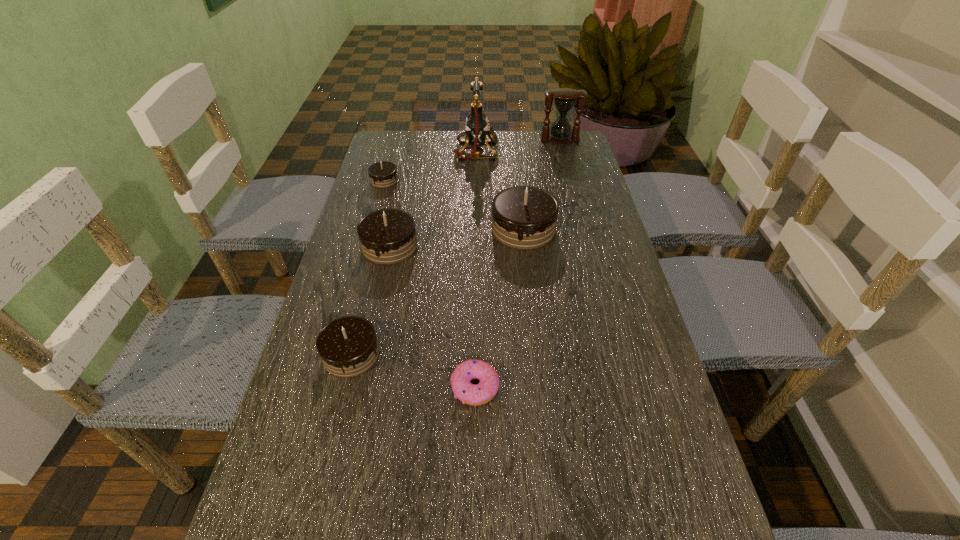
The width and height of the screenshot is (960, 540). In order to click on the tallest object in this screenshot , I will do `click(477, 127)`.

Where is `black telephone`? black telephone is located at coordinates (477, 127).

The image size is (960, 540). I want to click on hourglass, so click(565, 99).

Locate an element on the screen. The image size is (960, 540). brown hourglass is located at coordinates [x=565, y=99].

Locate an element on the screen. the rightmost chocolate chocolate cake is located at coordinates (523, 217).

Locate an element on the screen. This screenshot has width=960, height=540. the biggest chocolate chocolate cake is located at coordinates (523, 217).

You are a GUI agent. You are given a task and a screenshot of the screen. Output one action in this format:
    pyautogui.click(x=<x>, y=<y>)
    Task: Click on the third smallest chocolate chocolate cake
    
    Given the screenshot: What is the action you would take?
    pyautogui.click(x=387, y=236)

You are a GUI agent. You are given a task and a screenshot of the screen. Output one action in this format:
    pyautogui.click(x=<x>, y=<y>)
    Task: Click on the fifth shortest chocolate cake
    
    Given the screenshot: What is the action you would take?
    [387, 236]

Find the location of a particular element. This screenshot has height=540, width=960. the nearest chocolate chocolate cake is located at coordinates (348, 347).

The height and width of the screenshot is (540, 960). I want to click on the third nearest chocolate cake, so click(x=348, y=347).